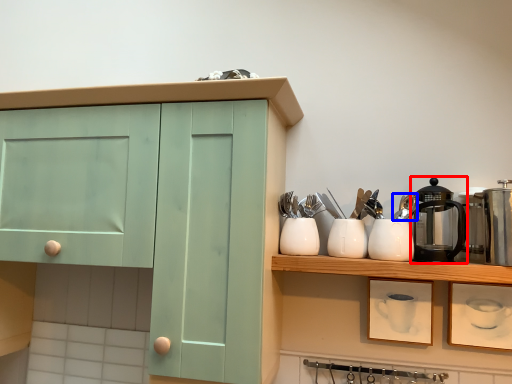
Question: Which point is closer to the camera, coffeepot (highlighted by a red box) or tableware (highlighted by a blue box)?

Choices:
 (A) coffeepot
 (B) tableware

Answer: (A)